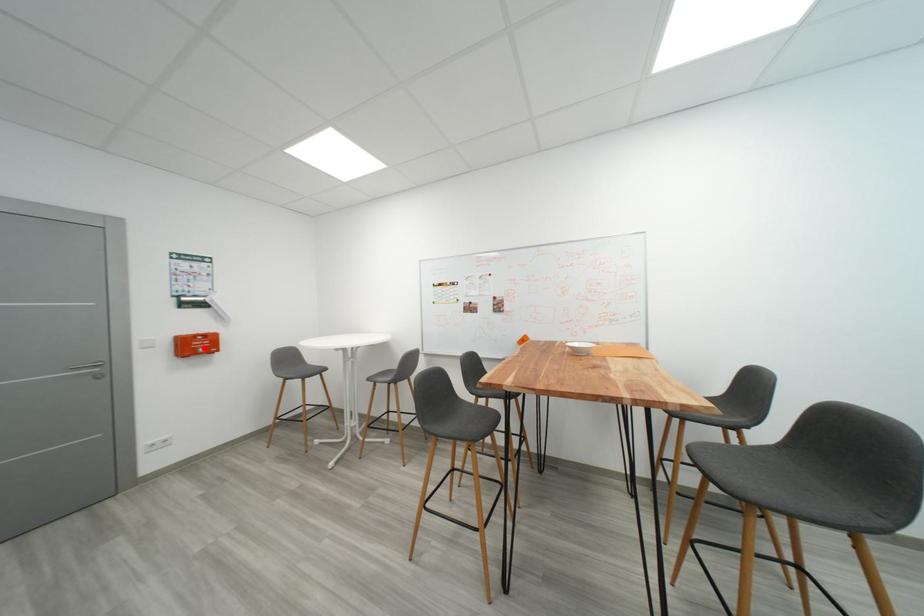
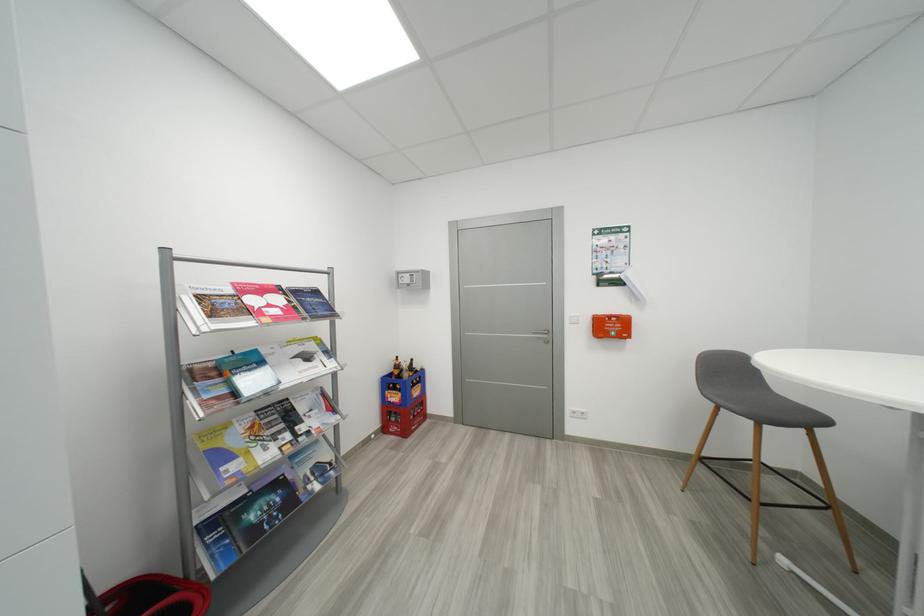
Locate, in the second image, the point that corresponds to the highlighted location in the first image.

(617, 330)